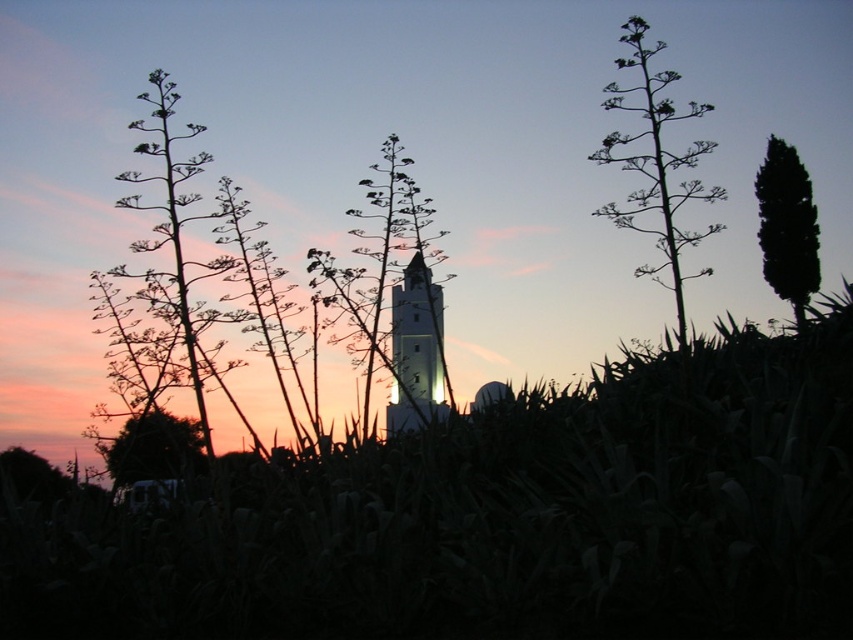
Question: Which point is farther to the camera?

Choices:
 (A) white smooth tower at center
 (B) green leafy plant at upper right
 (C) green leafy plant at lower left

Answer: (A)

Question: Based on their relative distances, which object is nearer to the silhouette leafy plant at left?

Choices:
 (A) green leafy plant at upper right
 (B) green leafy plant at center

Answer: (B)

Question: Can you confirm if silhouette leafy plant at left is positioned above green leafy tree at upper right?

Choices:
 (A) no
 (B) yes

Answer: (A)

Question: Is green leafy plant at upper right to the left of green leafy tree at upper right from the viewer's perspective?

Choices:
 (A) yes
 (B) no

Answer: (A)

Question: In this image, where is green leafy plant at upper right located relative to green leafy plant at lower left?

Choices:
 (A) below
 (B) above

Answer: (B)

Question: Among these objects, which one is nearest to the camera?

Choices:
 (A) silhouette leafy plant at left
 (B) green leafy plant at center
 (C) green leafy plant at lower left

Answer: (C)